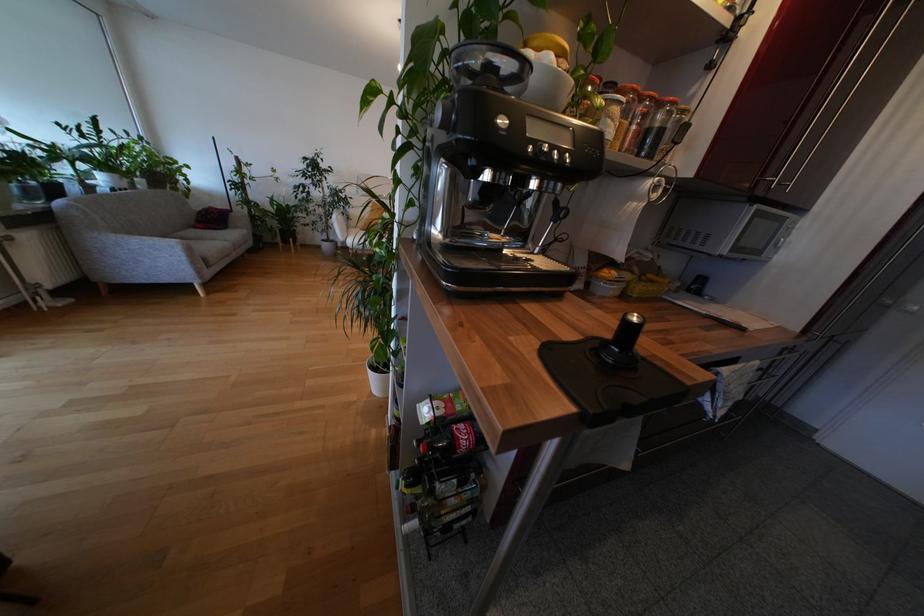
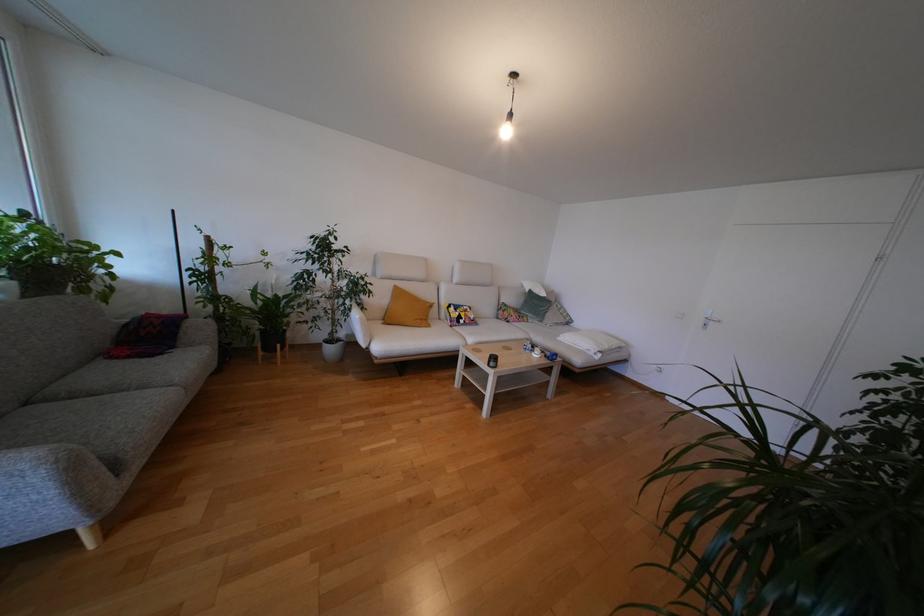
In a continuous first-person perspective shot, in which direction is the camera moving?

The cameraman moved toward left, forward.